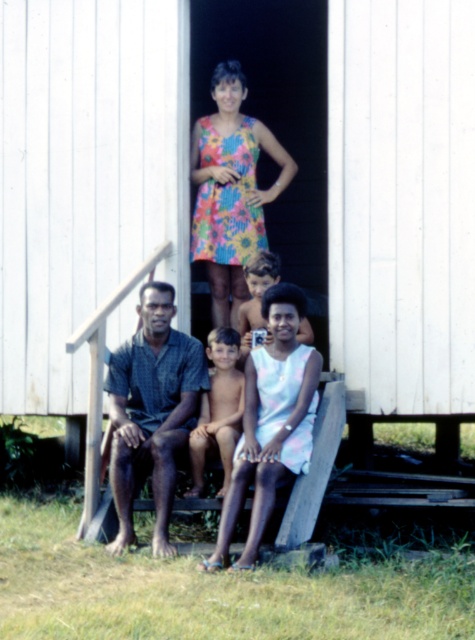
Question: In this image, where is dark blue plaid shirt at lower left located relative to light brown skin at center?

Choices:
 (A) left
 (B) right

Answer: (A)

Question: Which point is closer to the camera?

Choices:
 (A) 260,285
 (B) 116,440

Answer: (B)

Question: Is dark blue plaid shirt at lower left smaller than floral dress at center?

Choices:
 (A) no
 (B) yes

Answer: (A)

Question: From the image, what is the correct spatial relationship of pastel floral dress at center in relation to light brown skin at center?

Choices:
 (A) right
 (B) left

Answer: (B)

Question: Which of the following is the farthest from the observer?

Choices:
 (A) light brown skin at center
 (B) pastel floral dress at center
 (C) floral dress at center

Answer: (C)

Question: Which of the following is the farthest from the observer?

Choices:
 (A) light brown skin at center
 (B) dark blue plaid shirt at lower left
 (C) floral dress at center
 (D) pastel floral dress at center

Answer: (C)